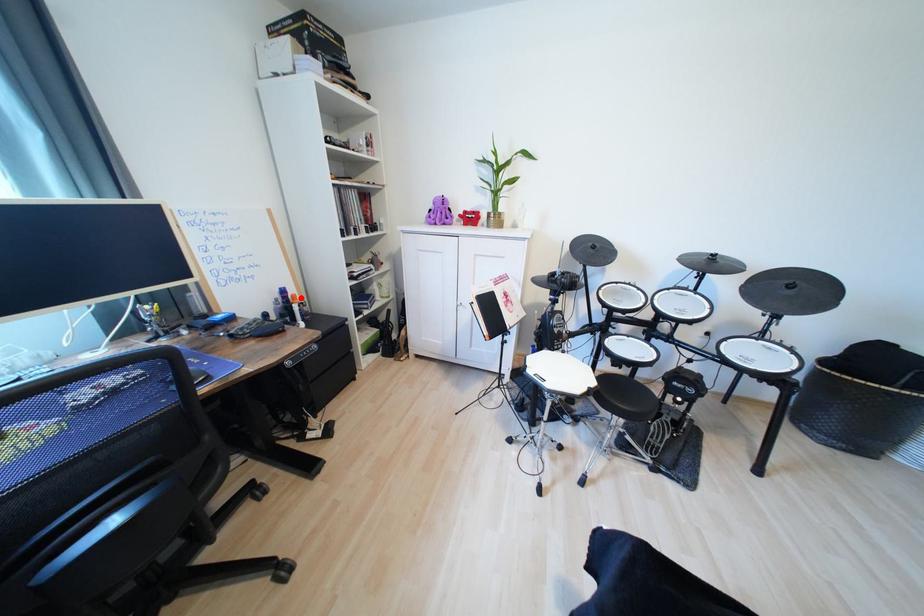
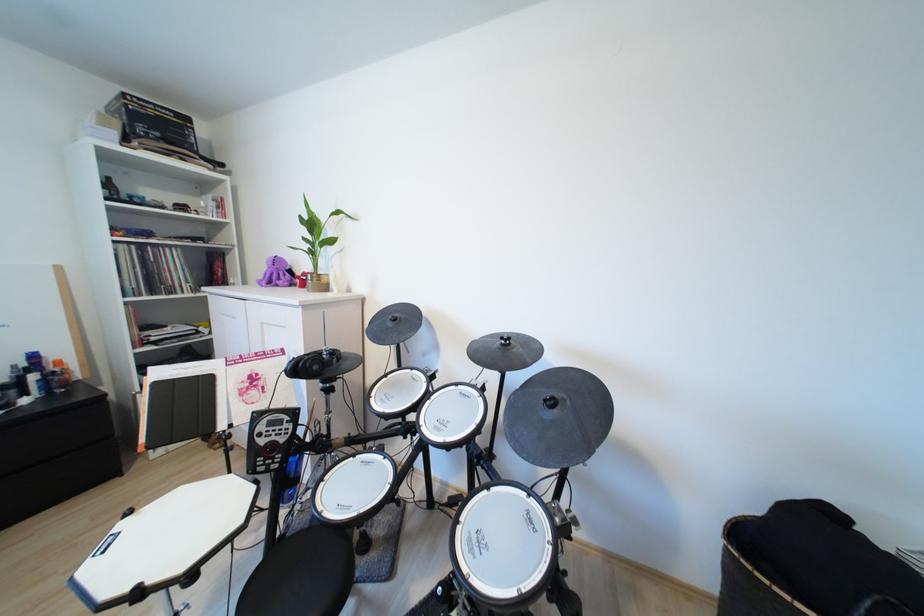
In the second image, find the point that corresponds to the highlighted location in the first image.

(66, 363)